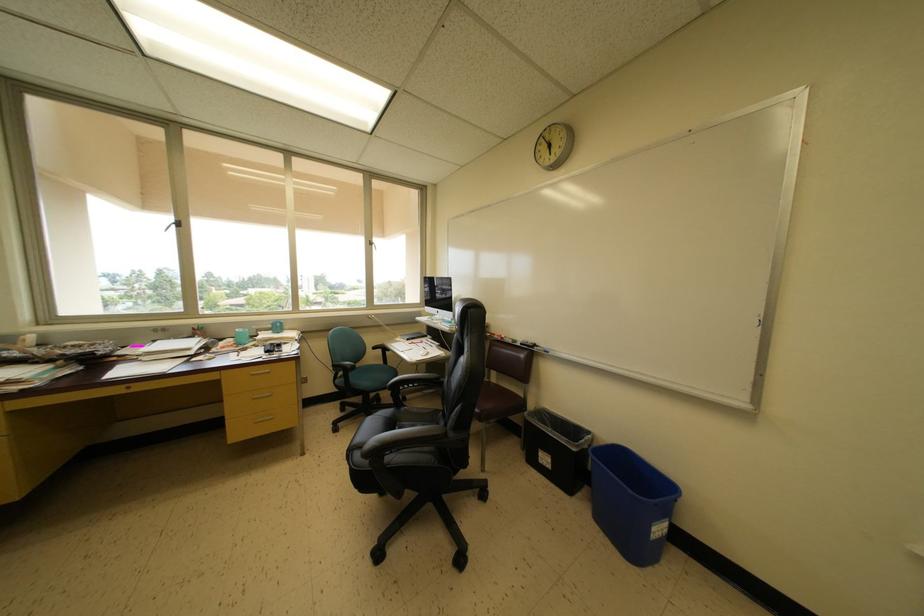
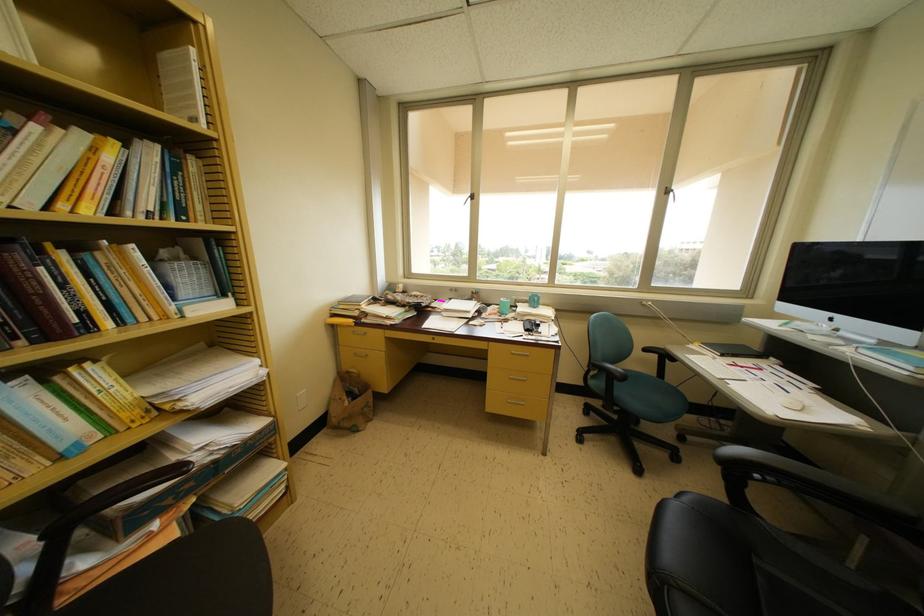
Where in the second image is the point corresponding to (159,346) from the first image?

(455, 304)